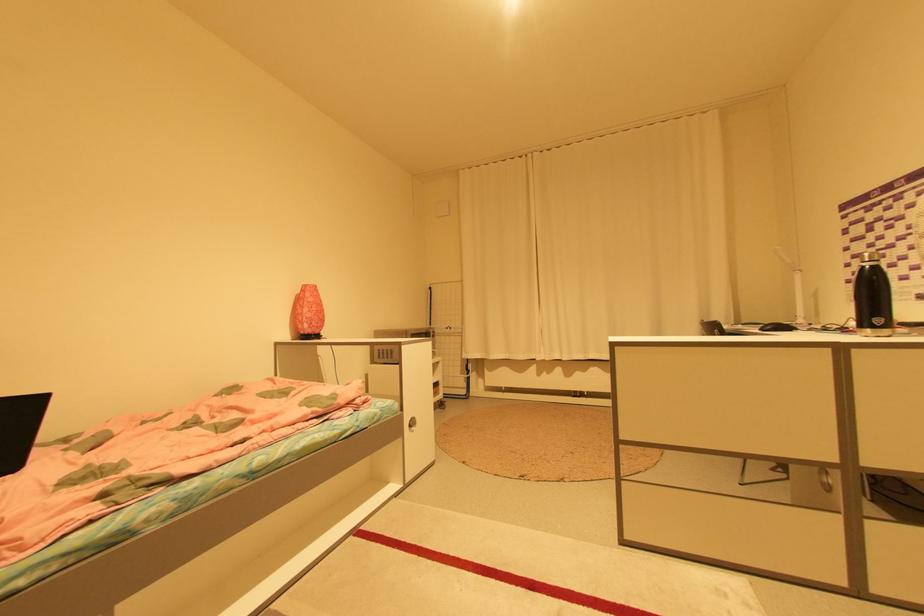
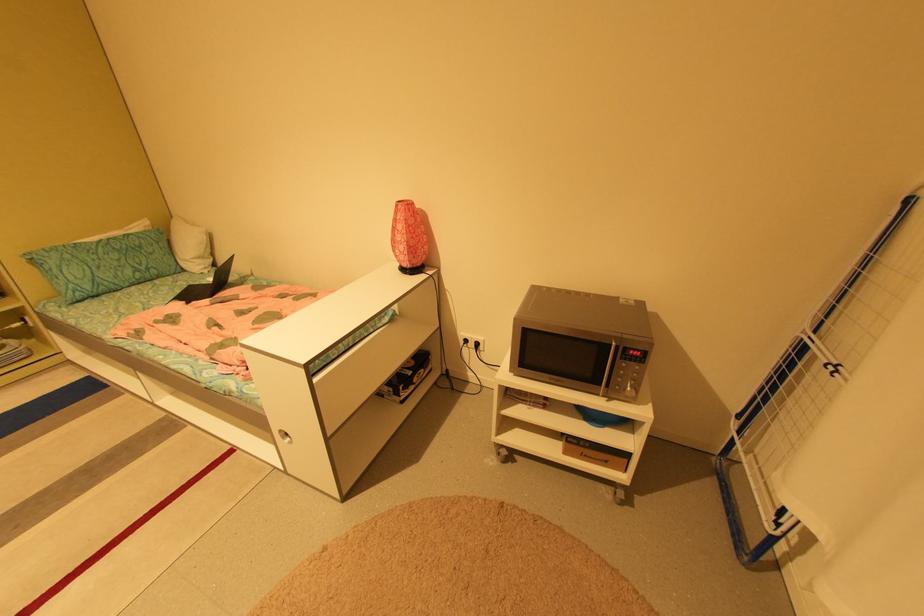
Locate, in the second image, the point that corresponds to point 311,285 in the first image.

(406, 201)